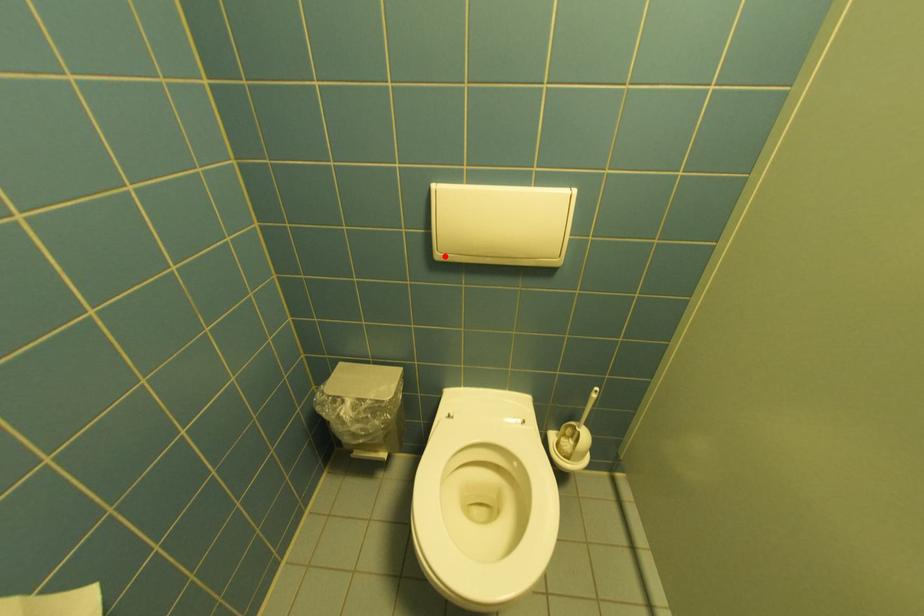
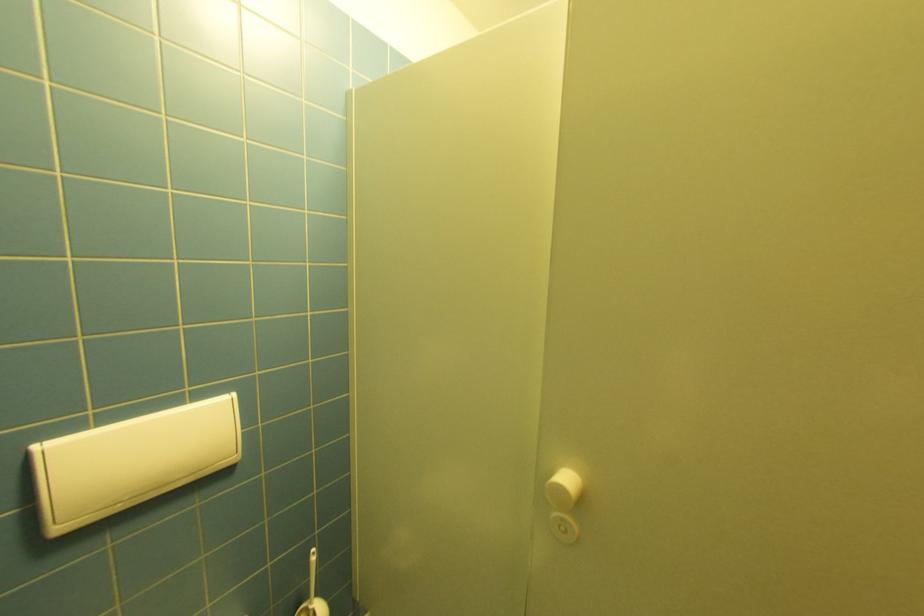
In the second image, find the point that corresponds to the highlighted location in the first image.

(66, 530)